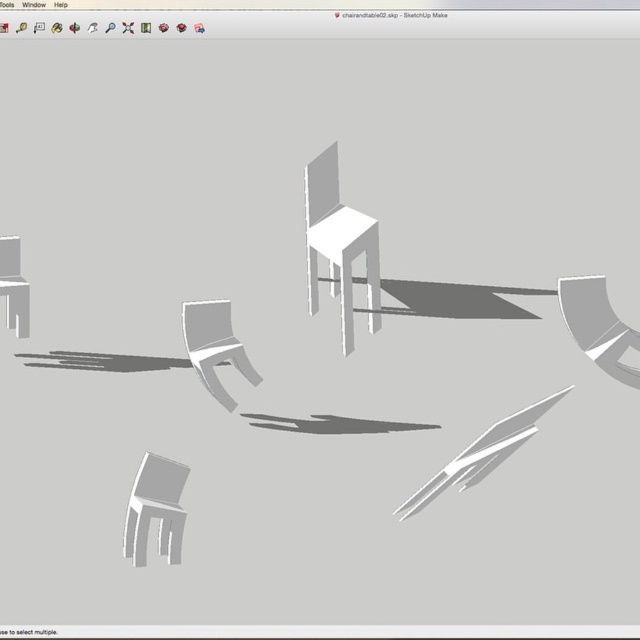
Does white matte chair at center have a greater width compared to matte gray chair at center?

Correct, the width of white matte chair at center exceeds that of matte gray chair at center.

Does white matte chair at center have a lesser width compared to matte gray chair at center?

In fact, white matte chair at center might be wider than matte gray chair at center.

Which is in front, point (317, 225) or point (205, 346)?

Point (205, 346) is in front.

Identify the location of white matte chair at center. This screenshot has width=640, height=640. (339, 243).

Does white matte chair at center appear on the right side of matte white cabinet at left?

Yes, white matte chair at center is to the right of matte white cabinet at left.

Is point (344, 330) closer to viewer compared to point (20, 294)?

No.

Where is `white matte chair at center`? This screenshot has height=640, width=640. white matte chair at center is located at coordinates (339, 243).

Does matte gray chair at lower left have a smaller size compared to matte white cabinet at left?

Actually, matte gray chair at lower left might be larger than matte white cabinet at left.

Which of these two, matte gray chair at lower left or matte white cabinet at left, stands shorter?

Standing shorter between the two is matte white cabinet at left.

Between point (177, 540) and point (16, 268), which one is positioned in front?

Point (177, 540)

Where is `matte gray chair at lower left`? The image size is (640, 640). matte gray chair at lower left is located at coordinates (156, 509).